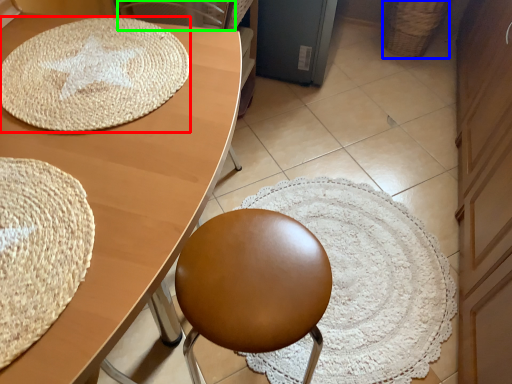
Question: Which object is positioned farthest from mat (highlighted by a red box)? Select from basket (highlighted by a blue box) and swivel chair (highlighted by a green box).

Choices:
 (A) basket
 (B) swivel chair

Answer: (A)